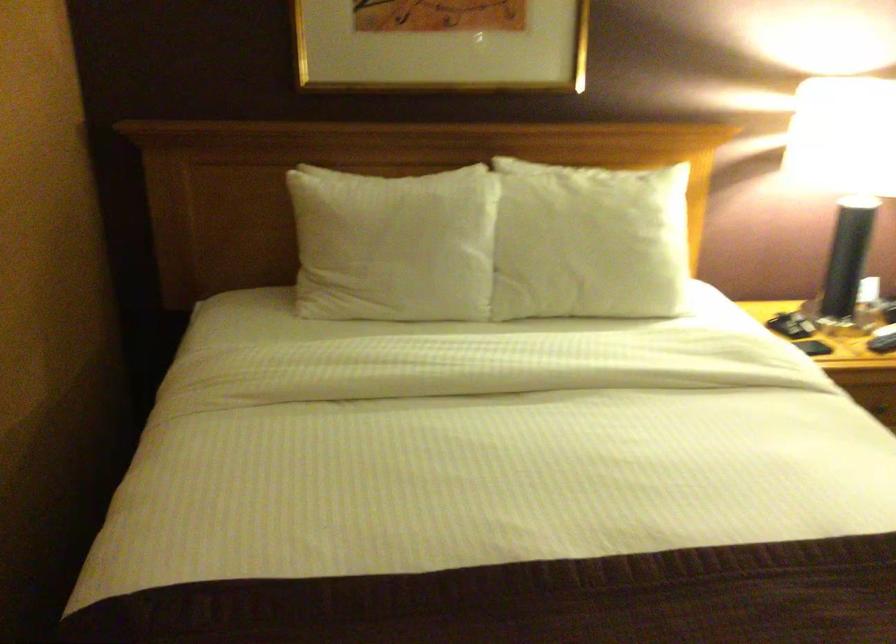
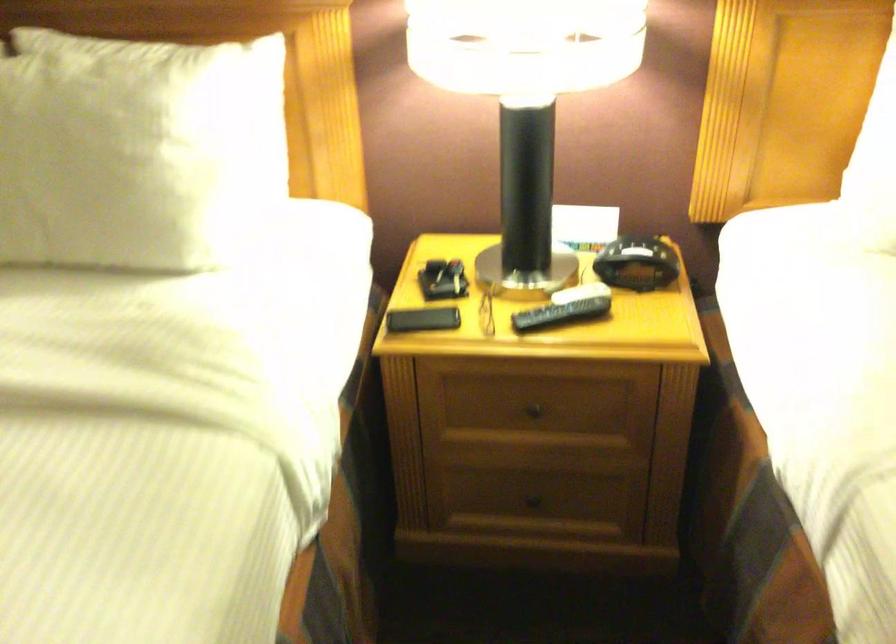
In the second image, find the point that corresponds to the point at 641,232 in the first image.

(134, 149)